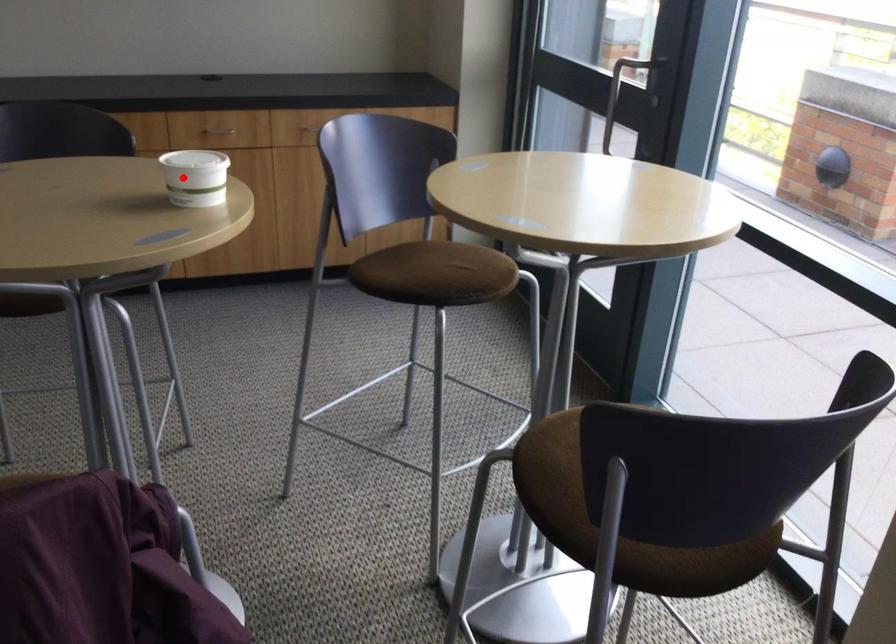
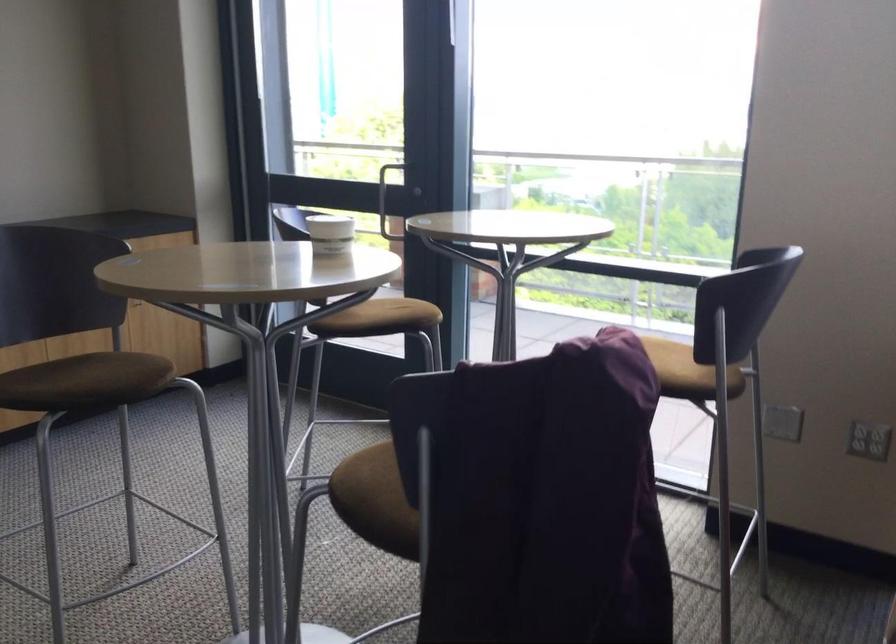
Question: I am providing you with two images of the same scene from different viewpoints. Image1 has a red point marked. In image2, the corresponding 3D location appears at what relative position? Reply with the corresponding letter.

Choices:
 (A) Closer
 (B) Farther

Answer: (B)